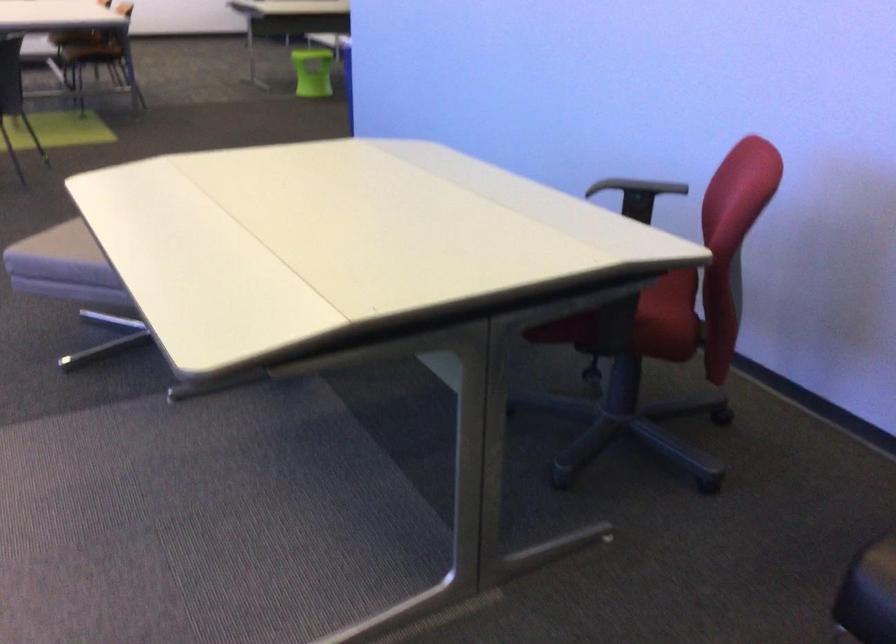
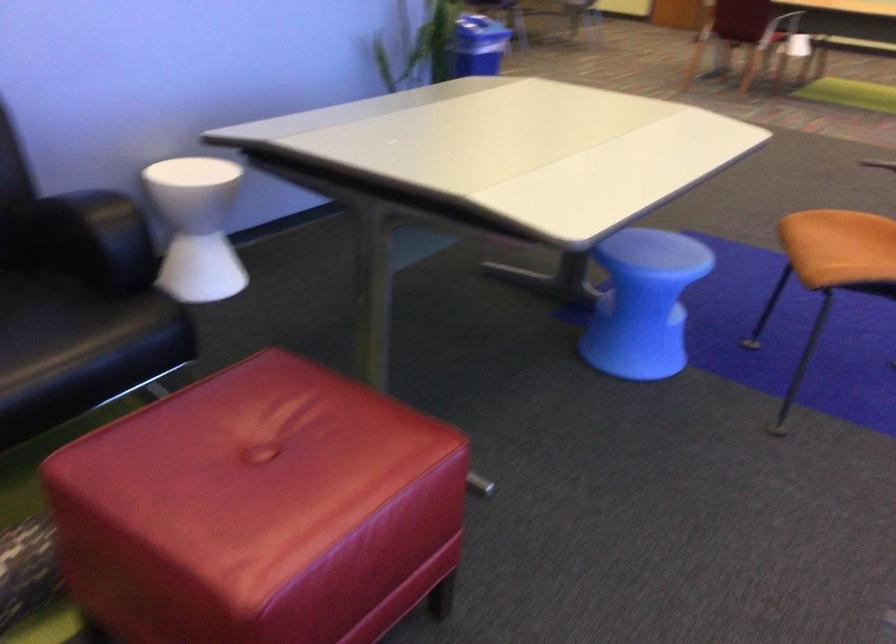
Based on the continuous images, in which direction is the camera rotating?

The camera's rotation is toward right-down.